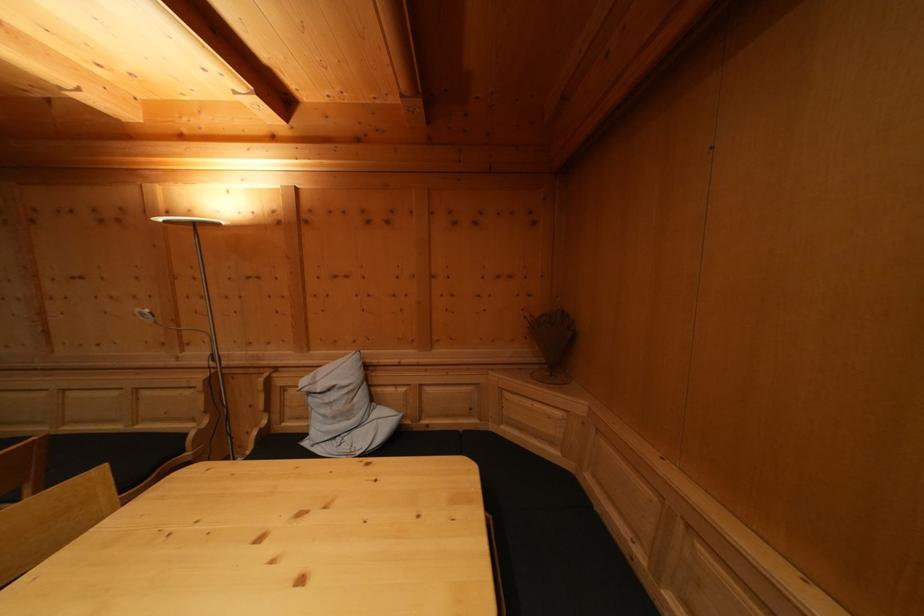
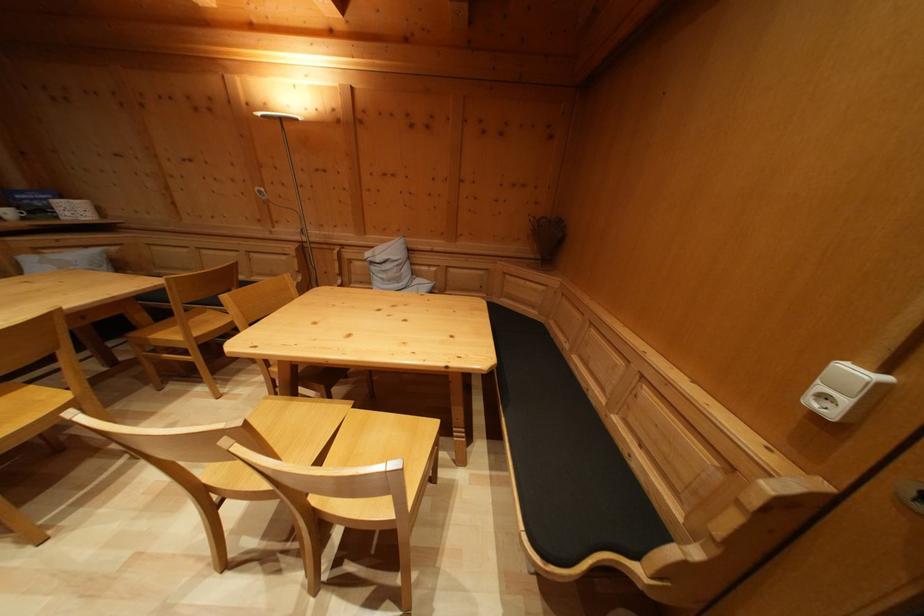
Question: How did the camera likely rotate?

Choices:
 (A) Left
 (B) Right
 (C) Up
 (D) Down

Answer: (D)